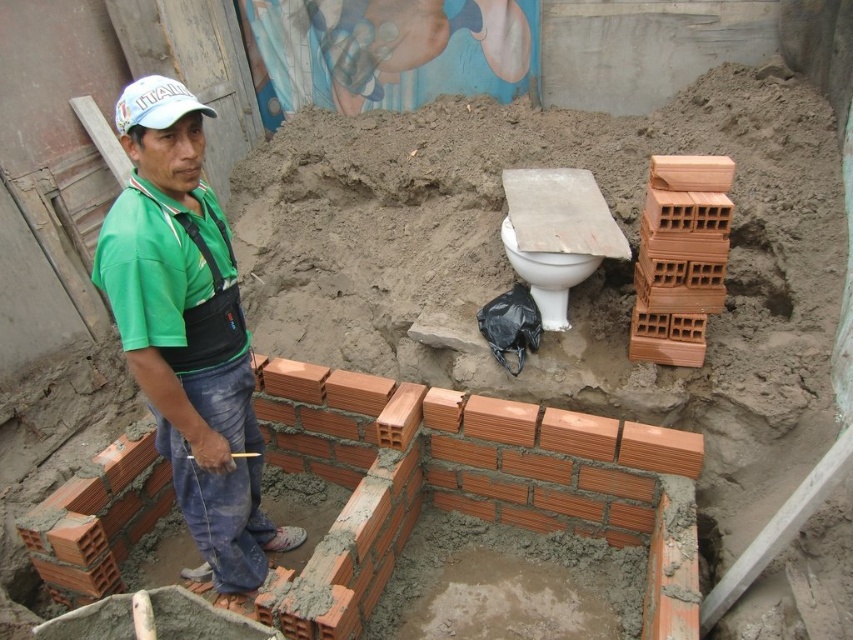
You are standing at the construction site and need to place a safety cone between the two points marked as point (x=190, y=182) and point (x=552, y=301). According to the coordinates, which point should the cone be closer to?

The cone should be placed closer to point (x=190, y=182) because it is in front of point (x=552, y=301), so the cone would logically be positioned nearer to the front point to mark the area effectively.

You are a construction worker who needs to know the relative heights of the objects in the scene to ensure proper placement. Which object, the white glossy toilet at center or the white matte baseball cap at upper left, is taller?

The white glossy toilet at center is taller than the white matte baseball cap at upper left according to the description.